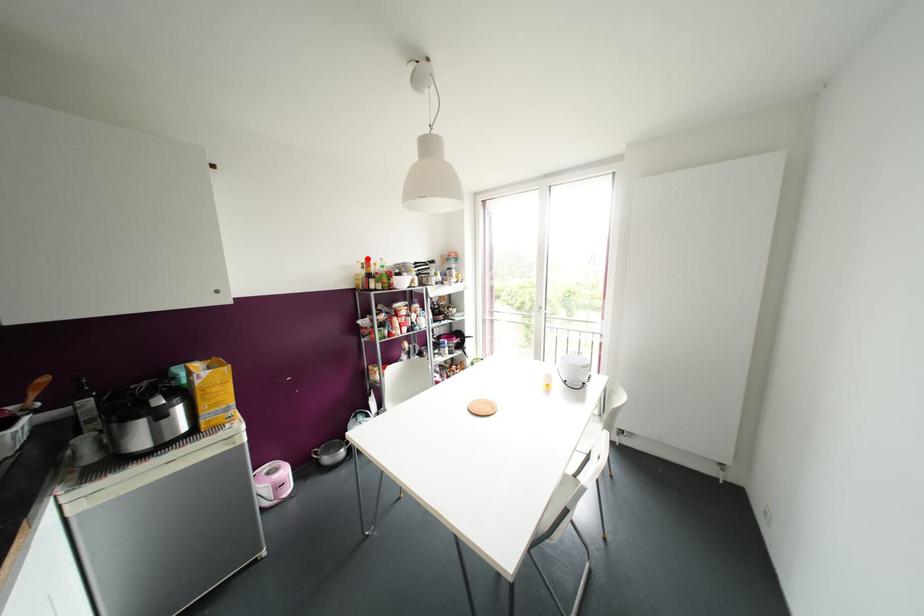
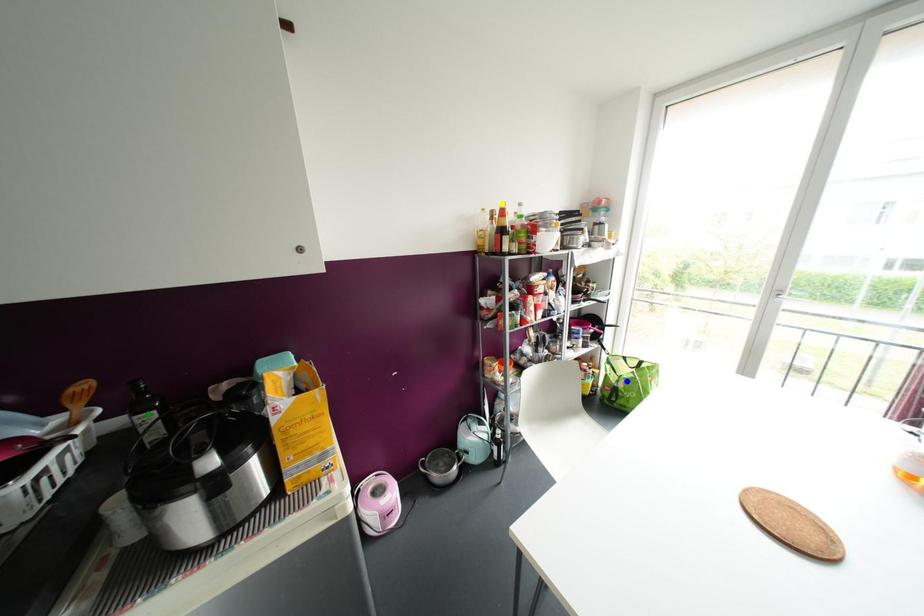
Question: I am providing you with two images of the same scene from different viewpoints. A red point is marked on the first image. You are given multiple points on the second image. Which spot in image 2 lines up with the point in image 1?

Choices:
 (A) blue point
 (B) yellow point
 (C) green point

Answer: (B)